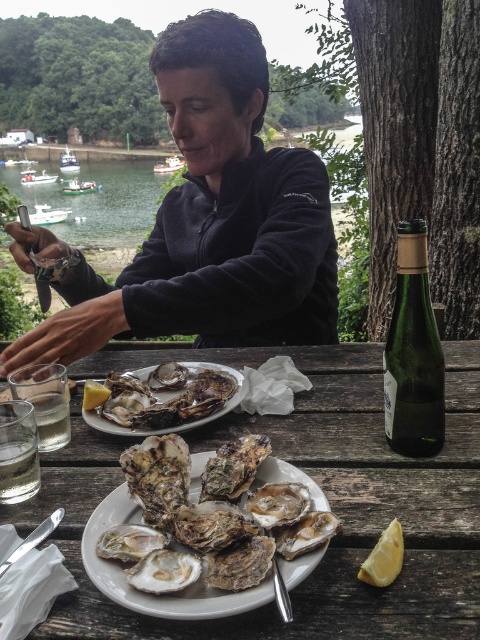
You are the person sitting at the wooden outdoor table shucking oysters. You want to reach for a lemon wedge that is at point (428, 372) and then grab the glass of water at point (90, 381). Which item will you need to reach further for first?

Point (428, 372) is in front of point (90, 381), so you will need to reach for the lemon wedge at point (428, 372) first since it is closer to you.

You are a guest at an oyster shucking event and want to reach for the clear water at upper left. Considering your arm length is 2.5 feet, can you comfortably reach it from your current position?

The clear water at upper left is 10.12 feet from viewer. Since your arm length is only 2.5 feet, you cannot comfortably reach it from your current position.